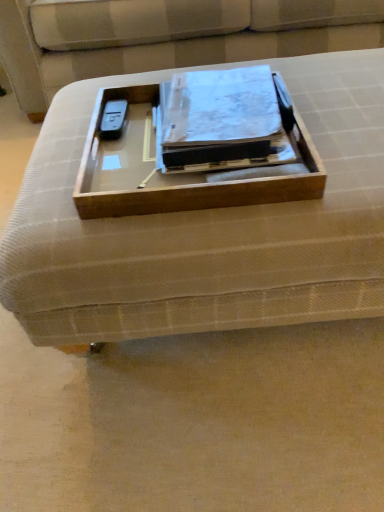
You are a GUI agent. You are given a task and a screenshot of the screen. Output one action in this format:
    pyautogui.click(x=<x>, y=<y>)
    Task: Click on the vacant region to the left of matte plastic binder at center
    
    Given the screenshot: What is the action you would take?
    click(x=67, y=148)